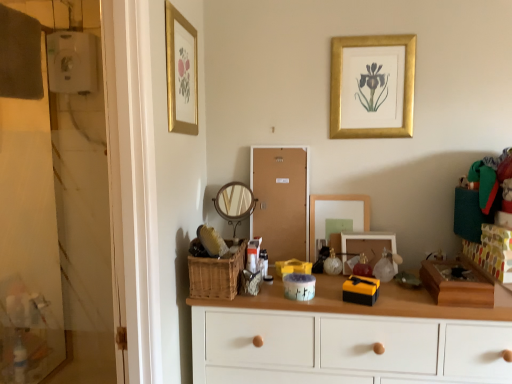
Image resolution: width=512 pixels, height=384 pixels. Find the location of `vacant area in front of translucent plastic container at center`. vacant area in front of translucent plastic container at center is located at coordinates (267, 298).